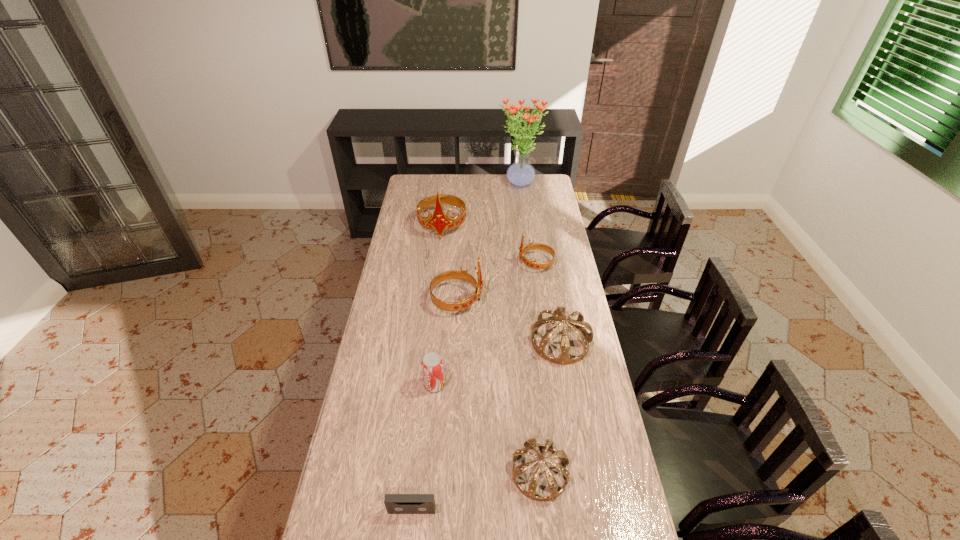
The image size is (960, 540). I want to click on the tallest object, so click(x=520, y=174).

Identify the location of flower arrangement. pos(520,174).

Locate an element on the screen. The height and width of the screenshot is (540, 960). the biggest red tiara is located at coordinates (439, 222).

Locate an element on the screen. This screenshot has width=960, height=540. the tallest tiara is located at coordinates (439, 222).

You are a GUI agent. You are given a task and a screenshot of the screen. Output one action in this format:
    pyautogui.click(x=<x>, y=<y>)
    Task: Click on the nearest red tiara
    The width and height of the screenshot is (960, 540).
    Given the screenshot: What is the action you would take?
    click(x=462, y=275)

Image resolution: width=960 pixels, height=540 pixels. What are the coordinates of `the second biggest red tiara` in the screenshot? It's located at (462, 275).

Locate an element on the screen. the second farthest red tiara is located at coordinates (531, 246).

I want to click on the second farthest tiara, so click(531, 246).

You are a GUI agent. You are given a task and a screenshot of the screen. Output one action in this format:
    pyautogui.click(x=<x>, y=<y>)
    Task: Click on the fourth nearest object
    The image size is (960, 540).
    Given the screenshot: What is the action you would take?
    [559, 315]

You are a GUI agent. You are given a task and a screenshot of the screen. Output one action in this format:
    pyautogui.click(x=<x>, y=<y>)
    Task: Click on the second shortest tiara
    Image resolution: width=960 pixels, height=540 pixels.
    Given the screenshot: What is the action you would take?
    pyautogui.click(x=559, y=315)